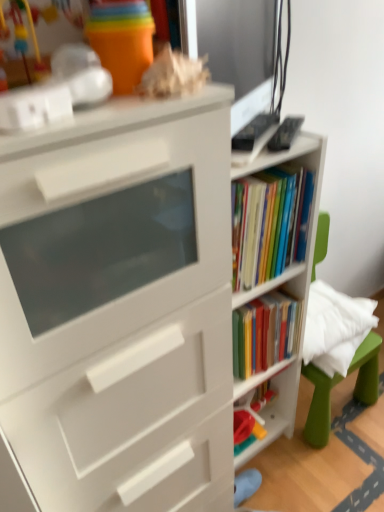
Question: Is green plastic swivel chair at right positioned far away from plastic toy at center, arranged as the 1th shelf when ordered from the bottom?

Choices:
 (A) no
 (B) yes

Answer: (A)

Question: Is green plastic swivel chair at right at the right side of plastic toy at center, arranged as the 1th shelf when ordered from the bottom?

Choices:
 (A) yes
 (B) no

Answer: (A)

Question: Does green plastic swivel chair at right have a greater height compared to plastic toy at center, which ranks as the 2th shelf in top-to-bottom order?

Choices:
 (A) yes
 (B) no

Answer: (A)

Question: Considering the relative sizes of green plastic swivel chair at right and plastic toy at center, arranged as the 1th shelf when ordered from the bottom, in the image provided, is green plastic swivel chair at right bigger than plastic toy at center, arranged as the 1th shelf when ordered from the bottom,?

Choices:
 (A) yes
 (B) no

Answer: (A)

Question: Is green plastic swivel chair at right at the left side of plastic toy at center, which ranks as the 2th shelf in top-to-bottom order?

Choices:
 (A) yes
 (B) no

Answer: (B)

Question: Is green plastic swivel chair at right bigger or smaller than white matte bookshelf at center, the 2th shelf ordered from the bottom?

Choices:
 (A) big
 (B) small

Answer: (A)

Question: Is point (369, 400) positioned closer to the camera than point (274, 281)?

Choices:
 (A) closer
 (B) farther

Answer: (B)

Question: Choose the correct answer: Is green plastic swivel chair at right inside white matte bookshelf at center, the 2th shelf ordered from the bottom, or outside it?

Choices:
 (A) outside
 (B) inside

Answer: (A)

Question: Considering the positions of green plastic swivel chair at right and white matte bookshelf at center, the 2th shelf ordered from the bottom, in the image, is green plastic swivel chair at right taller or shorter than white matte bookshelf at center, the 2th shelf ordered from the bottom,?

Choices:
 (A) short
 (B) tall

Answer: (A)

Question: Considering the positions of point (317, 403) and point (284, 418), is point (317, 403) closer or farther from the camera than point (284, 418)?

Choices:
 (A) farther
 (B) closer

Answer: (B)

Question: Do you think green plastic swivel chair at right is within plastic toy at center, which ranks as the 2th shelf in top-to-bottom order, or outside of it?

Choices:
 (A) inside
 (B) outside

Answer: (B)

Question: In terms of height, does green plastic swivel chair at right look taller or shorter compared to plastic toy at center, arranged as the 1th shelf when ordered from the bottom?

Choices:
 (A) tall
 (B) short

Answer: (A)

Question: From the image's perspective, is green plastic swivel chair at right positioned above or below plastic toy at center, which ranks as the 2th shelf in top-to-bottom order?

Choices:
 (A) above
 (B) below

Answer: (A)

Question: Considering the positions of white matte bookcase at center and plastic toy at center, which ranks as the 2th shelf in top-to-bottom order, in the image, is white matte bookcase at center bigger or smaller than plastic toy at center, which ranks as the 2th shelf in top-to-bottom order,?

Choices:
 (A) big
 (B) small

Answer: (A)

Question: From a real-world perspective, is white matte bookcase at center above or below plastic toy at center, which ranks as the 2th shelf in top-to-bottom order?

Choices:
 (A) below
 (B) above

Answer: (B)